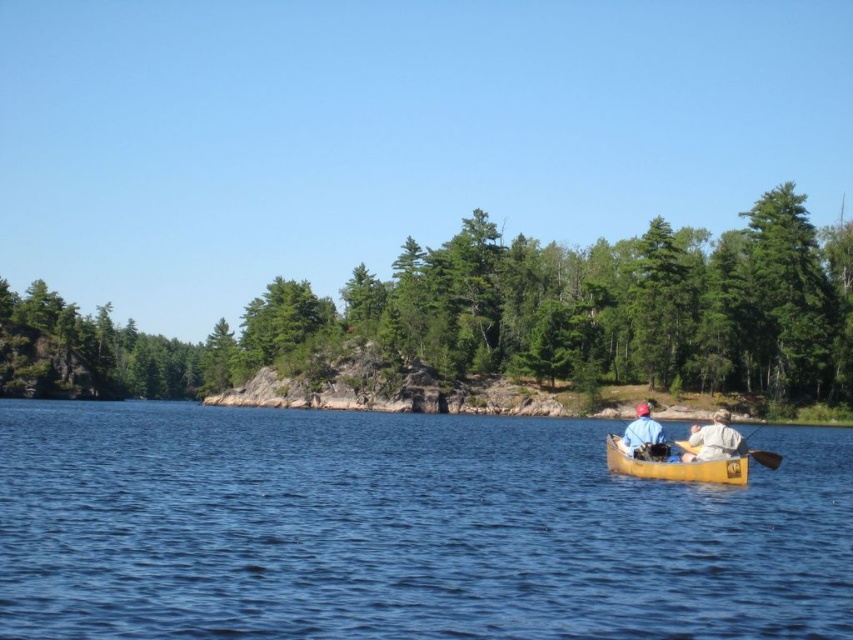
Question: Estimate the real-world distances between objects in this image. Which object is closer to the matte blue shirt at center?

Choices:
 (A) green leafy trees at center
 (B) yellow wood canoe at lower center

Answer: (B)

Question: Which point appears farthest from the camera in this image?

Choices:
 (A) 689,449
 (B) 444,346
 (C) 701,442
 (D) 703,490

Answer: (B)

Question: Can you confirm if blue water at center is positioned below green leafy trees at center?

Choices:
 (A) no
 (B) yes

Answer: (B)

Question: Is blue water at center bigger than yellow wood canoe at lower center?

Choices:
 (A) yes
 (B) no

Answer: (A)

Question: Is the position of blue water at center more distant than that of matte blue shirt at center?

Choices:
 (A) yes
 (B) no

Answer: (B)

Question: Which of the following is the closest to the observer?

Choices:
 (A) (682, 456)
 (B) (395, 609)
 (C) (764, 332)
 (D) (643, 435)

Answer: (B)